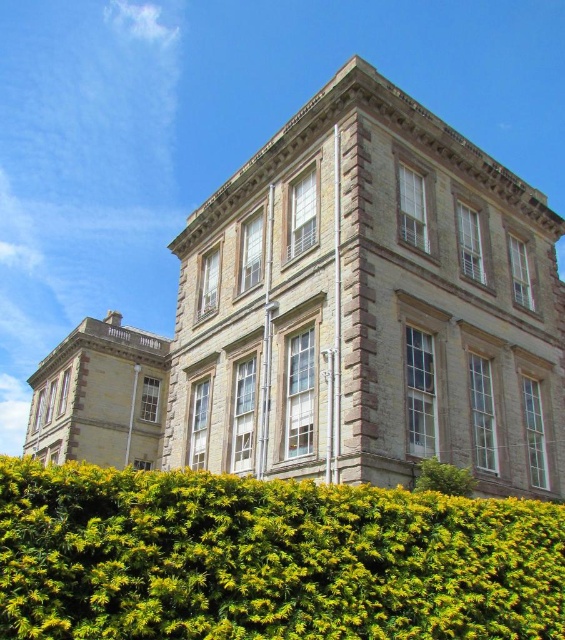
Question: Is green leafy hedge at lower center to the left of green leafy hedge at lower right from the viewer's perspective?

Choices:
 (A) yes
 (B) no

Answer: (A)

Question: Which point is closer to the camera taking this photo?

Choices:
 (A) (103, 509)
 (B) (434, 484)

Answer: (A)

Question: In this image, where is green leafy hedge at lower center located relative to green leafy hedge at lower right?

Choices:
 (A) below
 (B) above

Answer: (A)

Question: Which object is closer to the camera taking this photo?

Choices:
 (A) green leafy hedge at lower right
 (B) green leafy hedge at lower center

Answer: (B)

Question: Observing the image, what is the correct spatial positioning of green leafy hedge at lower center in reference to green leafy hedge at lower right?

Choices:
 (A) left
 (B) right

Answer: (A)